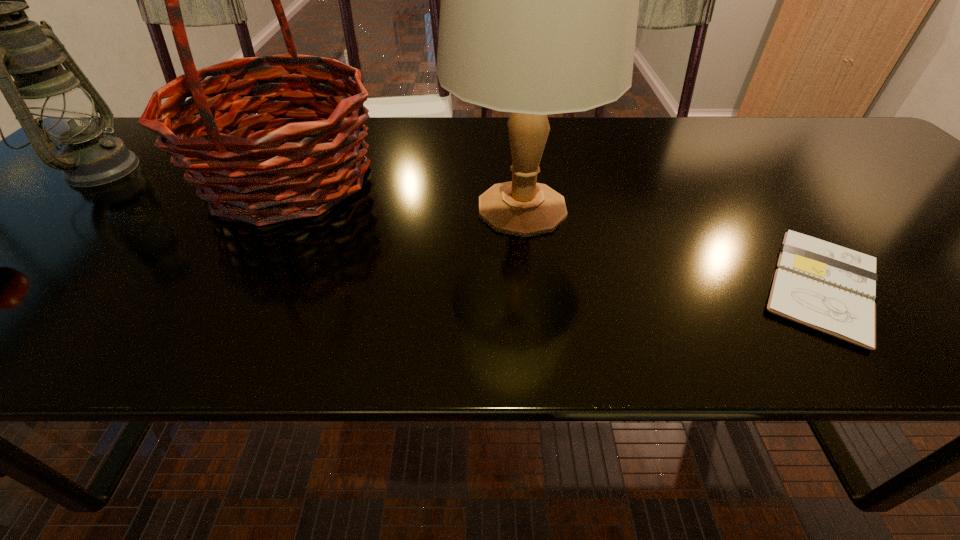
Locate an element on the screen. basket is located at coordinates (236, 172).

You are a GUI agent. You are given a task and a screenshot of the screen. Output one action in this format:
    pyautogui.click(x=<x>, y=<y>)
    Task: Click on the third object from left to right
    The width and height of the screenshot is (960, 540).
    Given the screenshot: What is the action you would take?
    539,6

Where is `the second shortest object`? the second shortest object is located at coordinates (46, 99).

The height and width of the screenshot is (540, 960). What are the coordinates of `oil lamp` in the screenshot? It's located at (46, 99).

Identify the location of the shortest object. This screenshot has width=960, height=540. (827, 287).

Where is `notepad`? notepad is located at coordinates (827, 287).

At what (x,y) coordinates should I click in order to perform the action: click on vacant area situated 0.090m on the handle side of the basket. Please return your answer as a coordinate pair (x, y). Looking at the image, I should click on (421, 179).

At what (x,y) coordinates should I click in order to perform the action: click on vacant space situated on the right of the table lamp. Please return your answer as a coordinate pair (x, y). This screenshot has width=960, height=540. Looking at the image, I should click on (700, 208).

Locate an element on the screen. The image size is (960, 540). vacant area situated on the back of the oil lamp is located at coordinates (141, 133).

The image size is (960, 540). I want to click on vacant space located 0.090m on the left of the rightmost object, so 700,286.